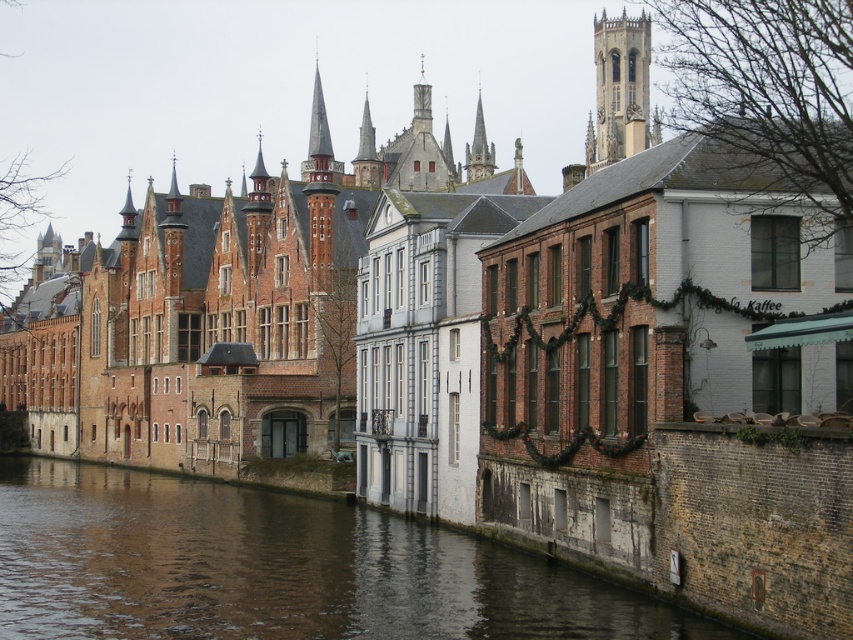
Question: In this image, where is stone clock tower at upper right located relative to gray stone tower at center?

Choices:
 (A) right
 (B) left

Answer: (A)

Question: Does stone clock tower at upper right have a larger size compared to gray stone tower at center?

Choices:
 (A) no
 (B) yes

Answer: (B)

Question: Which point is farther to the camera?

Choices:
 (A) gray stone tower at center
 (B) smooth gray stone spire at center
 (C) brown brick wall at lower right
 (D) stone clock tower at upper right

Answer: (B)

Question: Does stone clock tower at upper right have a lesser width compared to gray stone tower at center?

Choices:
 (A) no
 (B) yes

Answer: (A)

Question: Which point is closer to the camera taking this photo?

Choices:
 (A) (473, 564)
 (B) (622, 29)
 (C) (477, 150)

Answer: (A)

Question: Which point appears farthest from the camera in this image?

Choices:
 (A) (567, 579)
 (B) (408, 188)
 (C) (473, 156)
 (D) (643, 45)

Answer: (D)